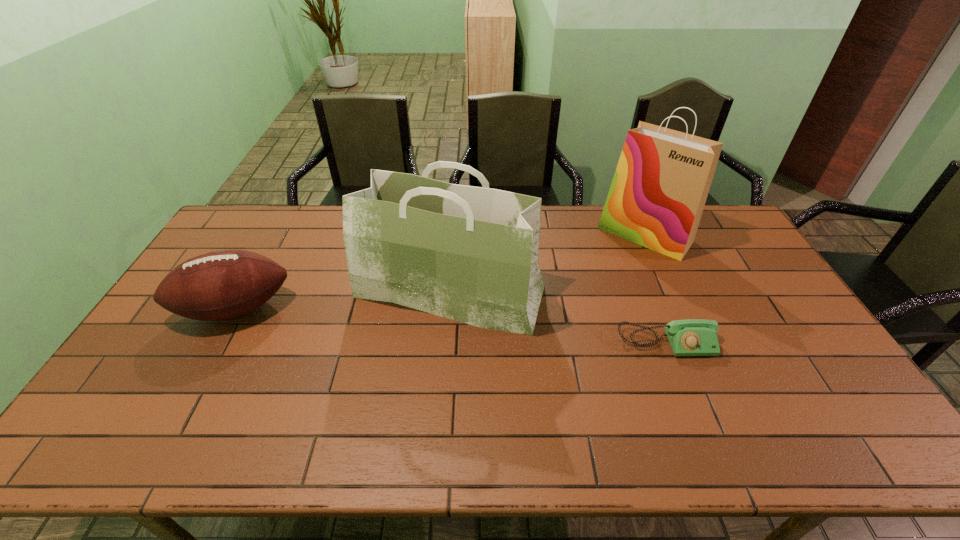
This screenshot has width=960, height=540. In order to click on object that is at the left edge in this screenshot , I will do `click(221, 285)`.

The image size is (960, 540). What are the coordinates of `vacant region at the far edge of the desktop` in the screenshot? It's located at (276, 241).

In the image, there is a desktop. Identify the location of free region at the near edge. This screenshot has width=960, height=540. (337, 456).

You are a GUI agent. You are given a task and a screenshot of the screen. Output one action in this format:
    pyautogui.click(x=<x>, y=<y>)
    Task: Click on the free space at the left edge
    
    Given the screenshot: What is the action you would take?
    pyautogui.click(x=170, y=392)

The image size is (960, 540). Find the location of `vacant space at the right edge of the desktop`. vacant space at the right edge of the desktop is located at coordinates (742, 246).

In the image, there is a desktop. At what (x,y) coordinates should I click in order to perform the action: click on vacant space at the far left corner. Please return your answer as a coordinate pair (x, y). The width and height of the screenshot is (960, 540). Looking at the image, I should click on (238, 222).

At what (x,y) coordinates should I click in order to perform the action: click on blank area at the near right corner. Please return your answer as a coordinate pair (x, y). The image size is (960, 540). Looking at the image, I should click on (854, 424).

At what (x,y) coordinates should I click in order to perform the action: click on vacant area between the leftmost object and the telephone. Please return your answer as a coordinate pair (x, y). Looking at the image, I should click on pyautogui.click(x=450, y=326).

Where is `free spot between the shortest object and the football (American)`? This screenshot has height=540, width=960. free spot between the shortest object and the football (American) is located at coordinates (450, 326).

Image resolution: width=960 pixels, height=540 pixels. Identify the location of free point between the shortest object and the grocery bag. (558, 316).